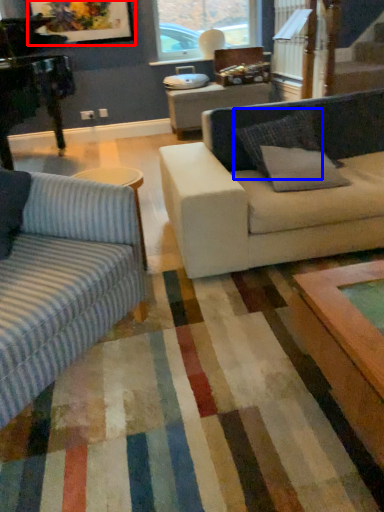
Question: Which point is further to the camera, picture frame (highlighted by a red box) or pillow (highlighted by a blue box)?

Choices:
 (A) picture frame
 (B) pillow

Answer: (A)